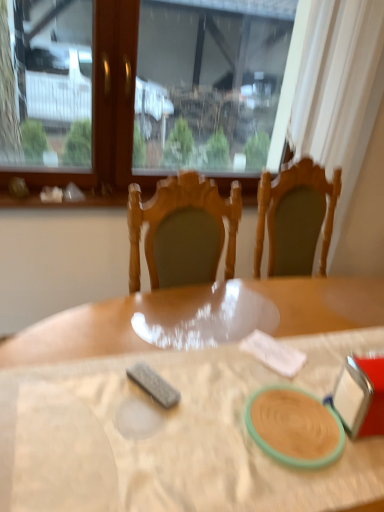
Where is `blank space situated above matte green plate at center (from a real-world perspective)`? The height and width of the screenshot is (512, 384). blank space situated above matte green plate at center (from a real-world perspective) is located at coordinates (296, 413).